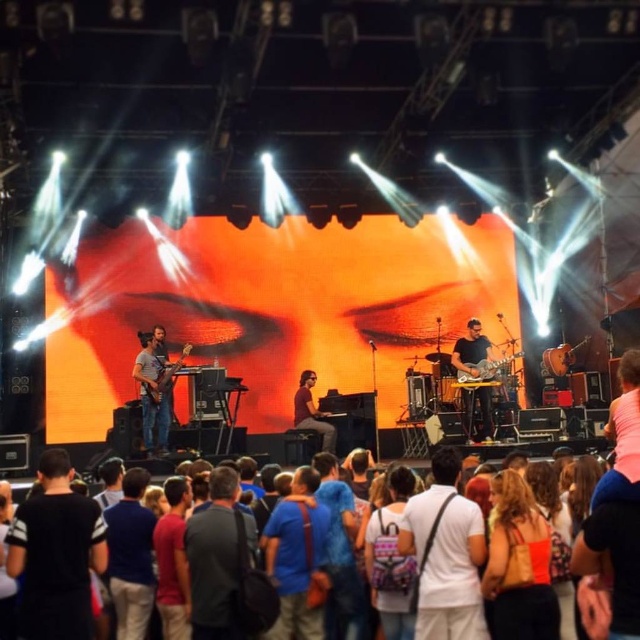
You are a photographer standing at the back of the concert venue. You want to take a photo of the black fabric shirt at lower left and the shiny metallic guitar at left. Based on their heights, which one will be partially hidden if you frame the shot to include both?

The black fabric shirt at lower left is shorter than the shiny metallic guitar at left, so the black fabric shirt at lower left will be partially hidden behind the taller shiny metallic guitar at left in the photo.

You are a photographer trying to capture a photo of the stage. You notice the white fabric shirt at center and the multicolored fabric crowd at lower center. Which object is closer to you, the photographer?

The white fabric shirt at center is closer to you than the multicolored fabric crowd at lower center.

You are a photographer at the concert and want to capture a clear shot of the white fabric shirt at center without the multicolored fabric crowd at lower center blocking it. Based on their thickness, which object is more likely to obstruct the view?

The multicolored fabric crowd at lower center is thicker than the white fabric shirt at center, so it is more likely to obstruct the view.